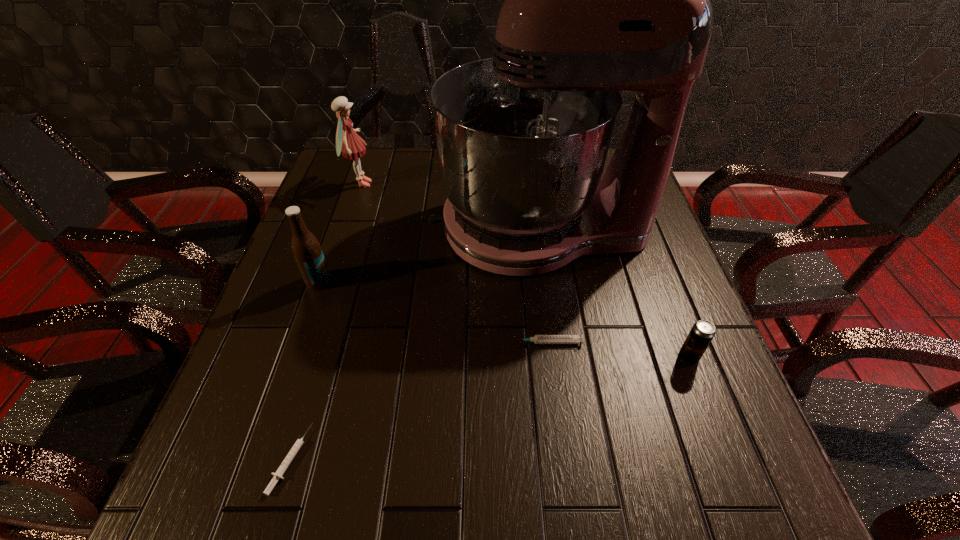
The width and height of the screenshot is (960, 540). What are the coordinates of `free space between the doll and the nearer syringe` in the screenshot? It's located at (325, 321).

The width and height of the screenshot is (960, 540). Find the location of `vacant space in between the mixer and the fourth tallest object`. vacant space in between the mixer and the fourth tallest object is located at coordinates [613, 292].

Select which object appears as the fourth closest to the mixer. Please provide its 2D coordinates. Your answer should be formatted as a tuple, i.e. [(x, y)], where the tuple contains the x and y coordinates of a point satisfying the conditions above.

[(306, 249)]

Identify the location of object that is the second nearest to the doll. (306, 249).

Identify the location of free location that satisfies the following two spatial constraints: 1. on the back side of the shorter syringe; 2. on the front-facing side of the fifth shortest object. The height and width of the screenshot is (540, 960). (372, 184).

You are a GUI agent. You are given a task and a screenshot of the screen. Output one action in this format:
    pyautogui.click(x=<x>, y=<y>)
    Task: Click on the free spot that satisfies the following two spatial constraints: 1. on the front-facing side of the mixer; 2. on the front side of the nearest object
    The image size is (960, 540).
    Given the screenshot: What is the action you would take?
    pyautogui.click(x=571, y=459)

This screenshot has width=960, height=540. I want to click on vacant space that satisfies the following two spatial constraints: 1. on the front-facing side of the doll; 2. on the left side of the third shortest object, so click(x=304, y=356).

This screenshot has height=540, width=960. I want to click on free space that satisfies the following two spatial constraints: 1. on the front-facing side of the doll; 2. on the front side of the fourth shortest object, so click(x=328, y=281).